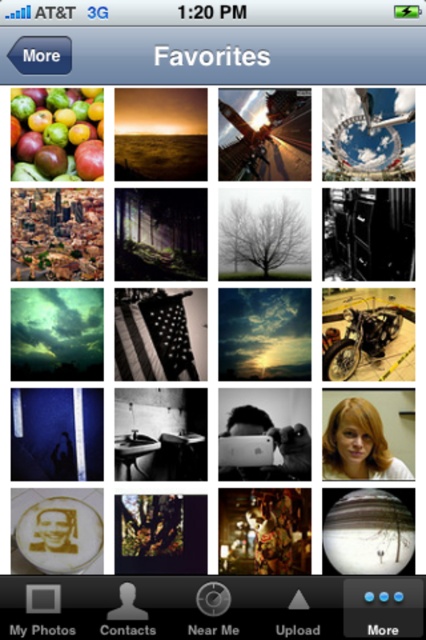
You are using a photo app and want to access the settings. The matte white button at bottom center and the black matte button at upper left are both potential options. Which button should you tap to access settings?

The black matte button at upper left is the correct button to access settings as it is typically located at the top left corner for menu options, while the matte white button at bottom center might be a different function like adding a new favorite.

You are using a mobile photo app and want to access the settings menu. The app requires you to tap the larger button first. Which button should you tap between the matte white button at bottom center and the black matte button at upper left?

The matte white button at bottom center has a larger size compared to the black matte button at upper left, so you should tap the matte white button at bottom center first to access the settings menu.

You have a stylus that is 5 inches long. You want to touch both the matte white button at bottom center and the black matte button at upper left in one continuous motion without lifting the stylus. Is this possible?

The matte white button at bottom center and black matte button at upper left are 5.04 inches apart from each other, so the 5 inch stylus is slightly too short to reach both buttons in one continuous motion without lifting.